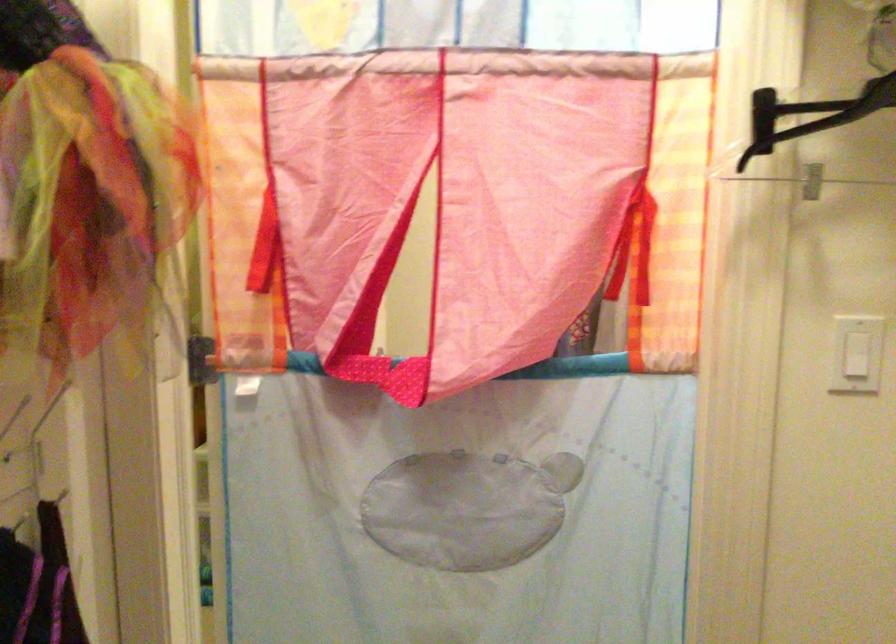
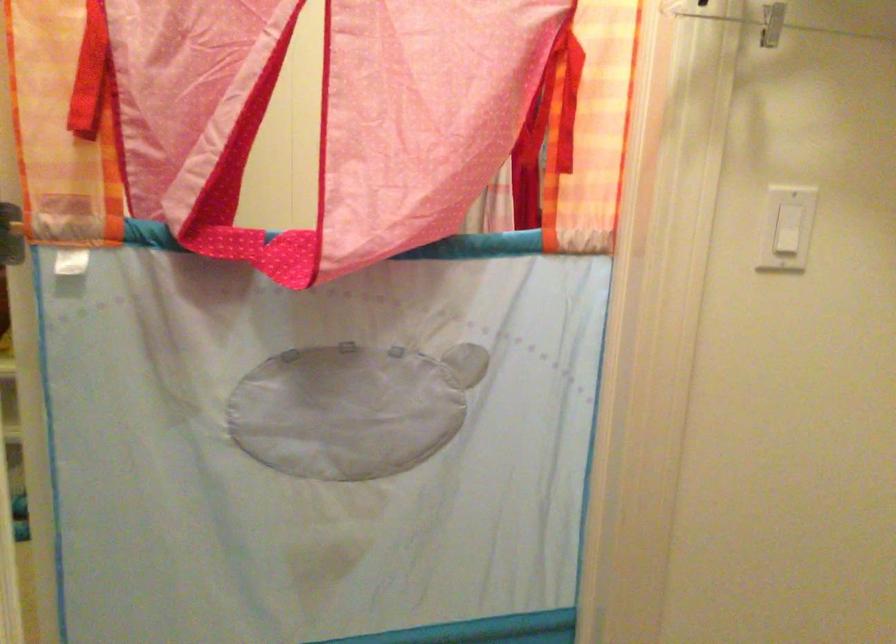
The point at (262, 245) is marked in the first image. Where is the corresponding point in the second image?

(90, 73)